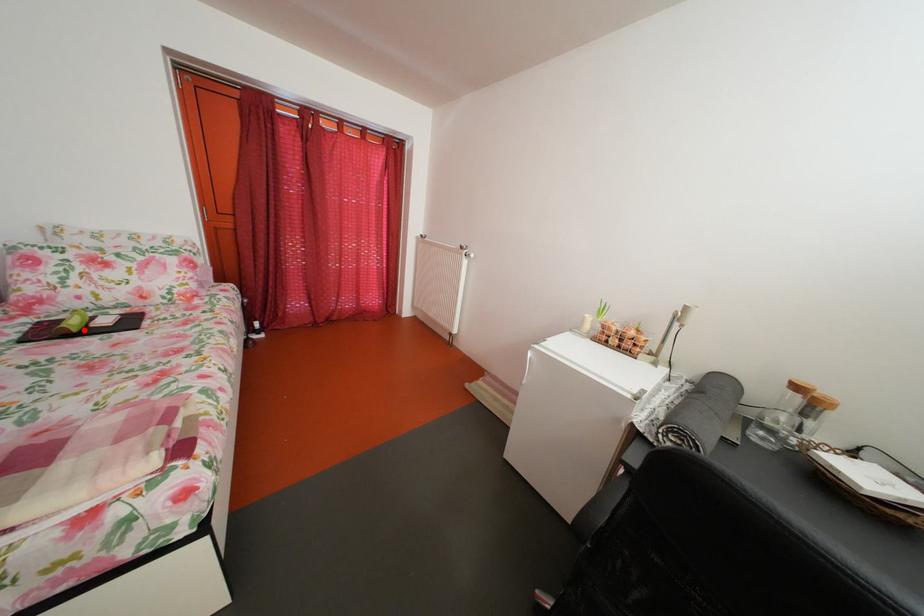
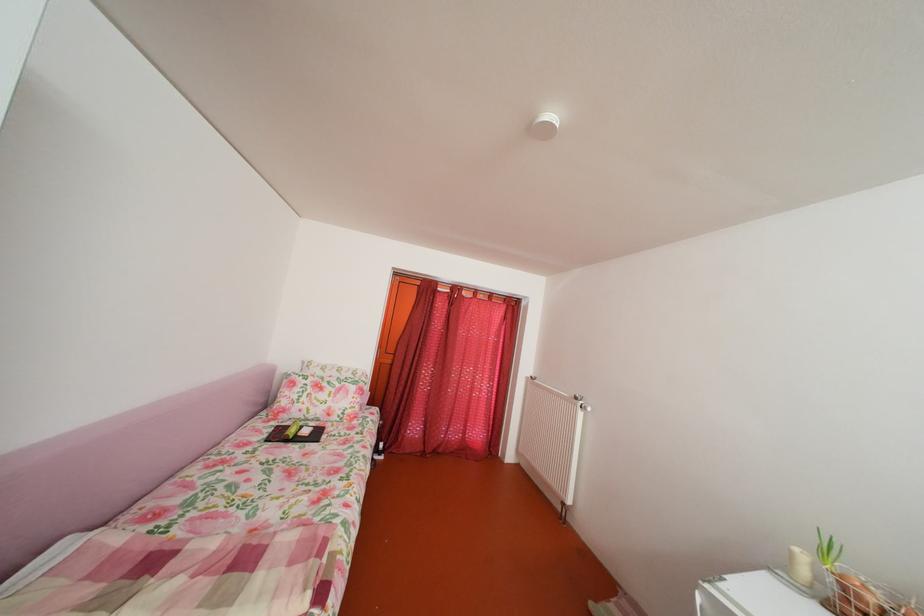
Locate, in the second image, the point that corresponds to the highlighted location in the first image.

(304, 438)